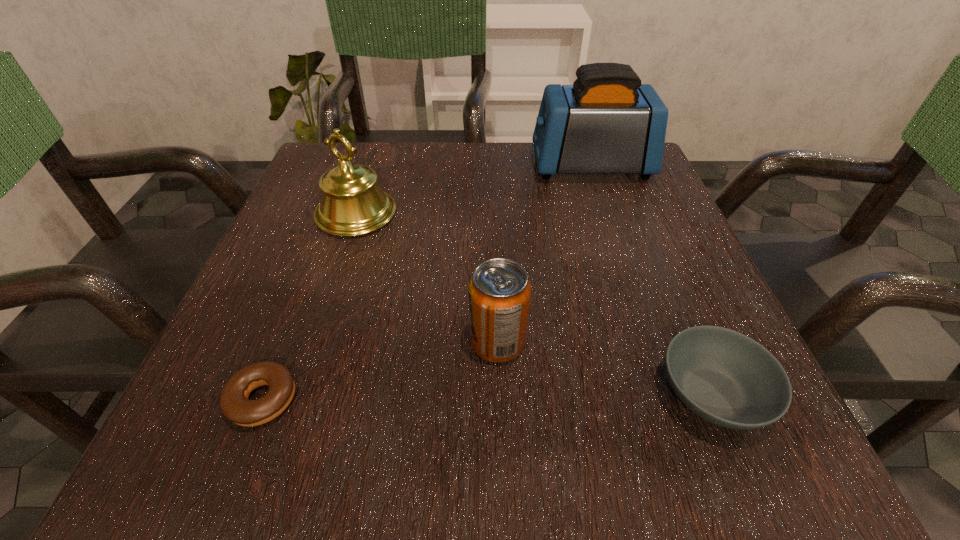
The height and width of the screenshot is (540, 960). Find the location of `vacant space at the right edge of the desktop`. vacant space at the right edge of the desktop is located at coordinates (644, 292).

Image resolution: width=960 pixels, height=540 pixels. I want to click on vacant space at the far left corner, so click(x=380, y=171).

This screenshot has width=960, height=540. In the image, there is a desktop. What are the coordinates of `free region at the far right corner` in the screenshot? It's located at (658, 191).

At what (x,y) coordinates should I click in order to perform the action: click on vacant space at the near right corner of the desktop. Please return your answer as a coordinate pair (x, y). The image size is (960, 540). Looking at the image, I should click on (711, 456).

Locate an element on the screen. The height and width of the screenshot is (540, 960). vacant space that is in between the soda can and the second shortest object is located at coordinates (605, 368).

The height and width of the screenshot is (540, 960). Identify the location of empty space that is in between the farthest object and the bell. (473, 190).

This screenshot has width=960, height=540. I want to click on free space between the third object from left to right and the shortest object, so click(x=380, y=371).

Where is `vacant space that's between the toaster and the shortest object`? Image resolution: width=960 pixels, height=540 pixels. vacant space that's between the toaster and the shortest object is located at coordinates (426, 283).

You are a GUI agent. You are given a task and a screenshot of the screen. Output one action in this format:
    pyautogui.click(x=<x>, y=<y>)
    Task: Click on the vacant space in between the soup bowl and the third tallest object
    The width and height of the screenshot is (960, 540).
    Given the screenshot: What is the action you would take?
    (605, 368)

Locate an element on the screen. This screenshot has width=960, height=540. vacant space in between the shortest object and the soup bowl is located at coordinates (487, 397).